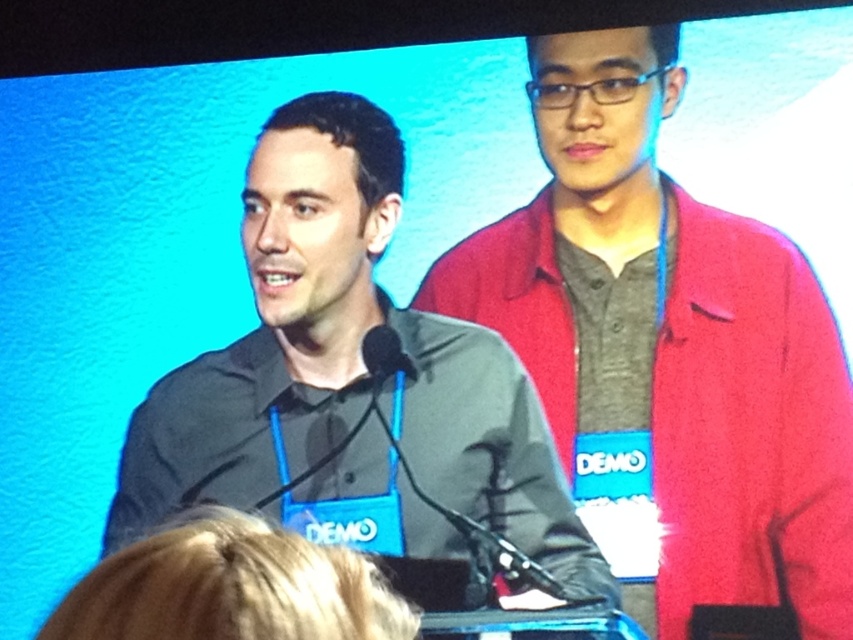
Question: Is matte red jacket at center below black matte shirt at center?

Choices:
 (A) yes
 (B) no

Answer: (B)

Question: Does matte red jacket at center appear on the right side of black matte shirt at center?

Choices:
 (A) no
 (B) yes

Answer: (B)

Question: Which object appears farthest from the camera in this image?

Choices:
 (A) black matte shirt at center
 (B) matte red jacket at center

Answer: (A)

Question: Which point is closer to the camera taking this photo?

Choices:
 (A) (473, 397)
 (B) (531, 358)

Answer: (B)

Question: Can you confirm if matte red jacket at center is positioned to the left of black matte shirt at center?

Choices:
 (A) yes
 (B) no

Answer: (B)